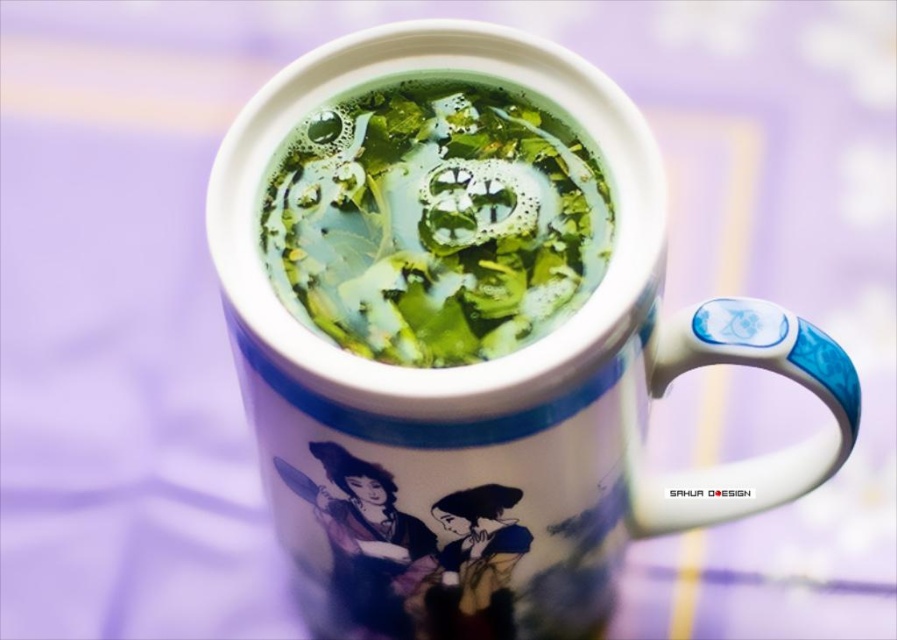
You are holding a smartphone camera and want to take a photo of the ceramic mug. You notice two points on the mug, one at coordinates point [577,541] and another at point [373,358]. Which point is closer to your camera lens?

Point [373,358] is closer to the camera lens because it is less further than point [577,541].

You are a barista trying to clean the white glossy mug at center and the green matte tea at center. Which object should you prioritize cleaning first based on their positions?

The white glossy mug at center is in front of the green matte tea at center, so you should prioritize cleaning the white glossy mug at center first since it is closer and obstructing the view of the tea.